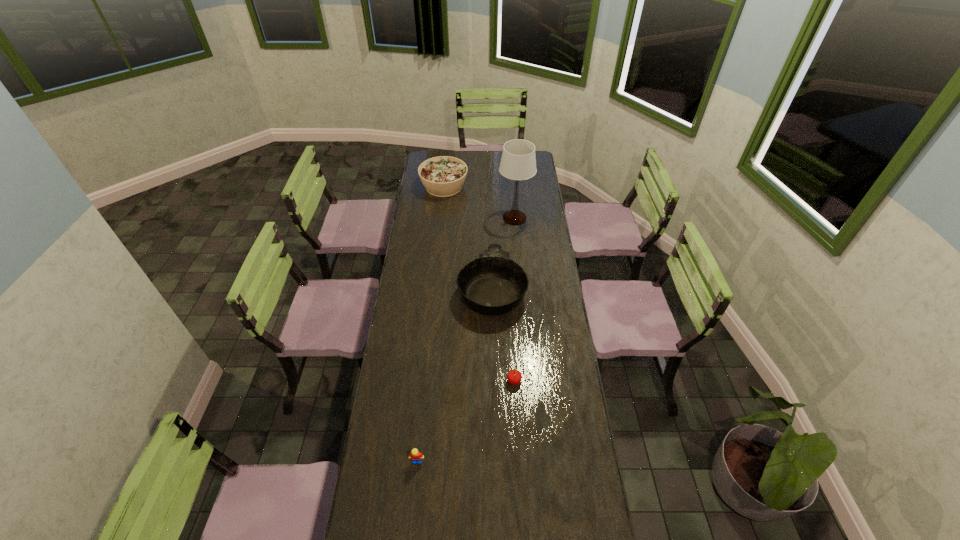
I want to click on vacant area at the right edge, so click(527, 246).

You are a GUI agent. You are given a task and a screenshot of the screen. Output one action in this format:
    pyautogui.click(x=<x>, y=<y>)
    Task: Click on the free space between the third nearest object and the salad
    The image size is (960, 540).
    Given the screenshot: What is the action you would take?
    pyautogui.click(x=468, y=237)

Find the location of a particular element. This screenshot has width=960, height=540. free space between the nearest object and the frying pan is located at coordinates (454, 374).

I want to click on free space between the fourth farthest object and the frying pan, so click(503, 334).

This screenshot has height=540, width=960. Identify the location of vacant space that's between the cherry and the third nearest object. (503, 334).

The image size is (960, 540). I want to click on unoccupied position between the cherry and the nearest object, so click(466, 421).

This screenshot has width=960, height=540. I want to click on free space between the cherry and the third farthest object, so coord(503,334).

Point out which object is positioned as the second nearest to the nearest object. Please provide its 2D coordinates. Your answer should be formatted as a tuple, i.e. [(x, y)], where the tuple contains the x and y coordinates of a point satisfying the conditions above.

[(493, 284)]

You are a GUI agent. You are given a task and a screenshot of the screen. Output one action in this format:
    pyautogui.click(x=<x>, y=<y>)
    Task: Click on the object that is the second closest to the third nearest object
    
    Given the screenshot: What is the action you would take?
    pyautogui.click(x=514, y=377)